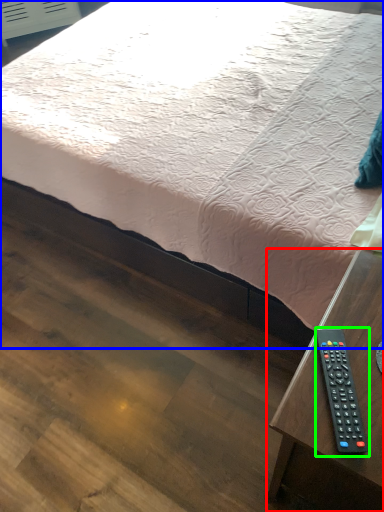
Question: Considering the real-world distances, which object is closest to table (highlighted by a red box)? bed (highlighted by a blue box) or remote control (highlighted by a green box).

Choices:
 (A) bed
 (B) remote control

Answer: (B)